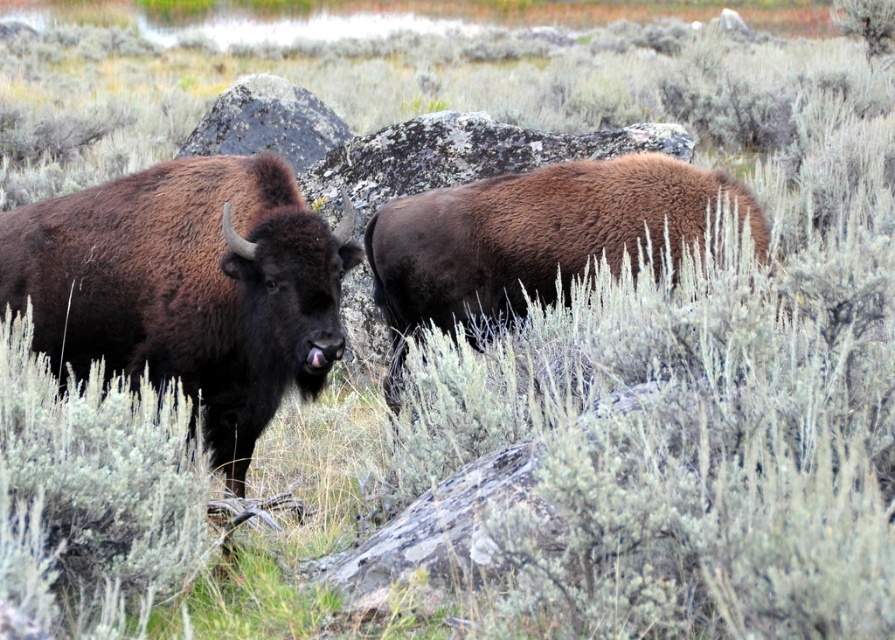
Question: Can you confirm if brown fuzzy buffalo at left is positioned to the left of brown fuzzy bison at center?

Choices:
 (A) no
 (B) yes

Answer: (B)

Question: Among these objects, which one is nearest to the camera?

Choices:
 (A) gray rock at center
 (B) brown fuzzy bison at center

Answer: (B)

Question: Which point is farther to the camera?

Choices:
 (A) gray rock at center
 (B) brown fuzzy buffalo at left

Answer: (A)

Question: Which object is positioned farthest from the gray rock at center?

Choices:
 (A) brown fuzzy bison at center
 (B) brown fuzzy buffalo at left

Answer: (B)

Question: In this image, where is brown fuzzy bison at center located relative to gray rock at center?

Choices:
 (A) left
 (B) right

Answer: (B)

Question: Does brown fuzzy bison at center appear under gray rock at center?

Choices:
 (A) yes
 (B) no

Answer: (A)